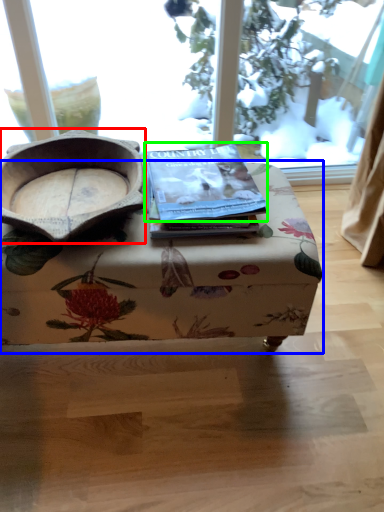
Question: Based on their relative distances, which object is farther from bowl (highlighted by a red box)? Choose from table (highlighted by a blue box) and paperback book (highlighted by a green box).

Choices:
 (A) table
 (B) paperback book

Answer: (A)